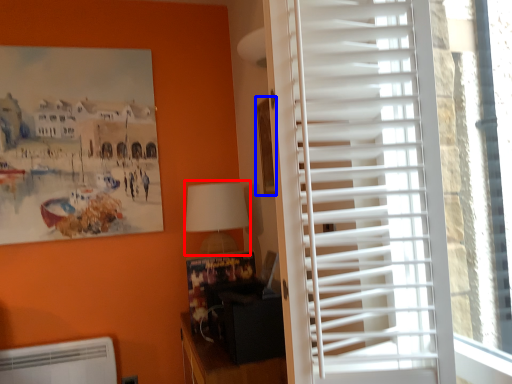
Question: Which object appears farthest to the camera in this image, table lamp (highlighted by a red box) or picture frame (highlighted by a blue box)?

Choices:
 (A) table lamp
 (B) picture frame

Answer: (A)